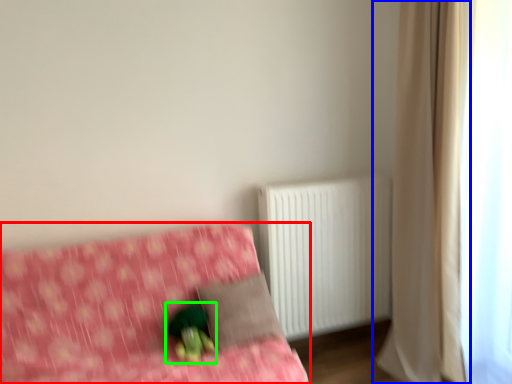
Question: Considering the real-world distances, which object is closest to furniture (highlighted by a red box)? curtain (highlighted by a blue box) or figurine (highlighted by a green box).

Choices:
 (A) curtain
 (B) figurine

Answer: (B)